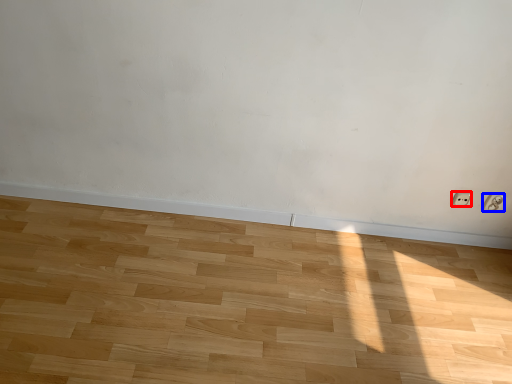
Question: Among these objects, which one is nearest to the camera, electric outlet (highlighted by a red box) or electric outlet (highlighted by a blue box)?

Choices:
 (A) electric outlet
 (B) electric outlet

Answer: (B)